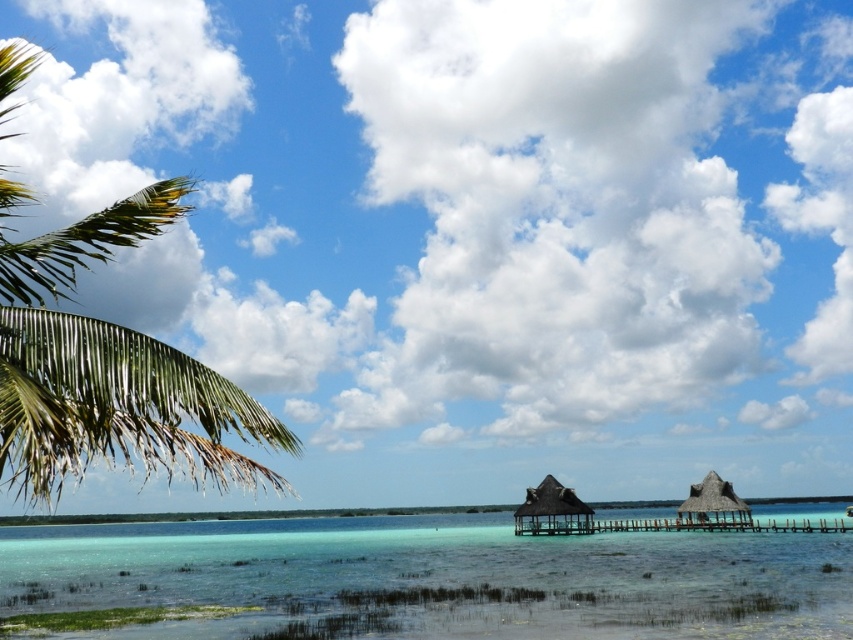
Looking at this image, is the position of clear water at lower center more distant than that of green leafy palm tree at left?

Yes, it is behind green leafy palm tree at left.

Which is more to the left, clear water at lower center or green leafy palm tree at left?

From the viewer's perspective, green leafy palm tree at left appears more on the left side.

Between point (277, 545) and point (154, 422), which one is positioned in front?

Point (154, 422) is more forward.

Find the location of a particular element. clear water at lower center is located at coordinates (434, 579).